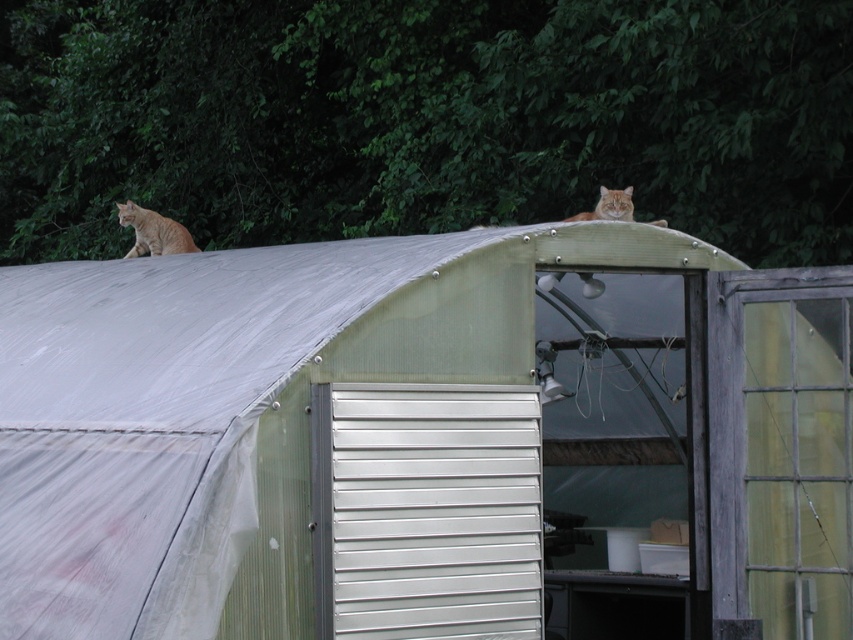
Is point (334, 499) positioned after point (126, 253)?

No, (334, 499) is closer to viewer.

Can you confirm if metallic silver hut at center is positioned to the right of orange fur cat at left?

Indeed, metallic silver hut at center is positioned on the right side of orange fur cat at left.

Is point (234, 616) positioned in front of point (134, 236)?

That is True.

Find the location of a particular element. metallic silver hut at center is located at coordinates (427, 442).

Is point (161, 246) positioned before point (567, 216)?

Yes, it is.

Is point (192, 244) positioned behind point (627, 220)?

That is True.

At what (x,y) coordinates should I click in order to perform the action: click on orange fur cat at left. Please return your answer as a coordinate pair (x, y). This screenshot has width=853, height=640. Looking at the image, I should click on (154, 230).

Between metallic silver hut at center and orange fur cat at upper center, which one has more height?

metallic silver hut at center is taller.

Can you confirm if metallic silver hut at center is positioned to the left of orange fur cat at upper center?

Indeed, metallic silver hut at center is positioned on the left side of orange fur cat at upper center.

Between point (563, 474) and point (610, 214), which one is positioned behind?

The point (563, 474) is behind.

The height and width of the screenshot is (640, 853). Identify the location of metallic silver hut at center. (427, 442).